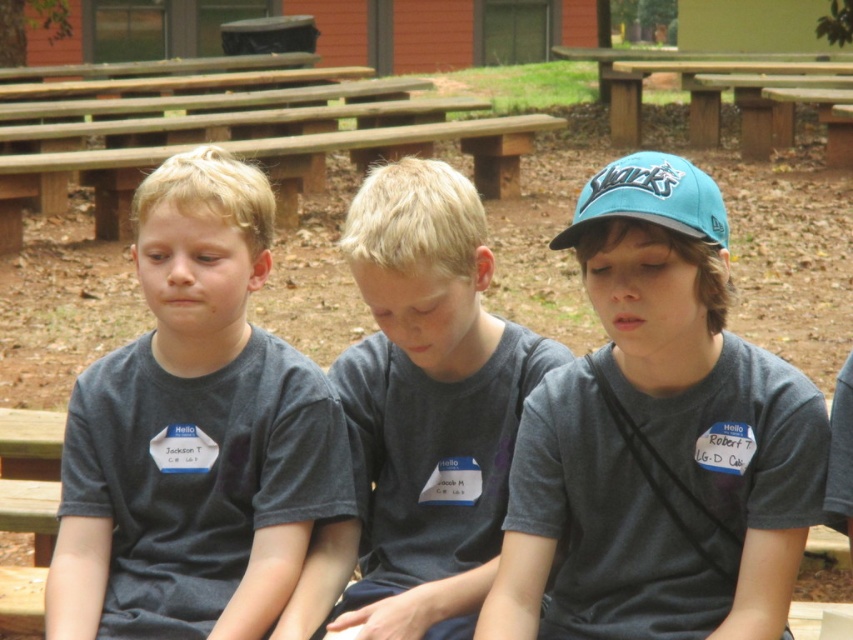
You are a photographer trying to capture a group photo of the boys. You need to ensure that the gray cotton shirt at center and the wooden picnic table at upper center are both visible in the frame. Given their sizes, which object should you focus on to make sure both are in the shot?

The gray cotton shirt at center is taller than the wooden picnic table at upper center, so you should focus on the gray cotton shirt at center to ensure both are visible in the frame.

You are a photographer trying to capture a group photo of the boys. You need to position yourself so that both the wooden bench at center and the wooden picnic table at upper center are visible in the frame. Based on their positions, which object should you place on the left side of your photo?

The wooden bench at center is to the left of the wooden picnic table at upper center, so you should place the wooden bench at center on the left side of your photo.